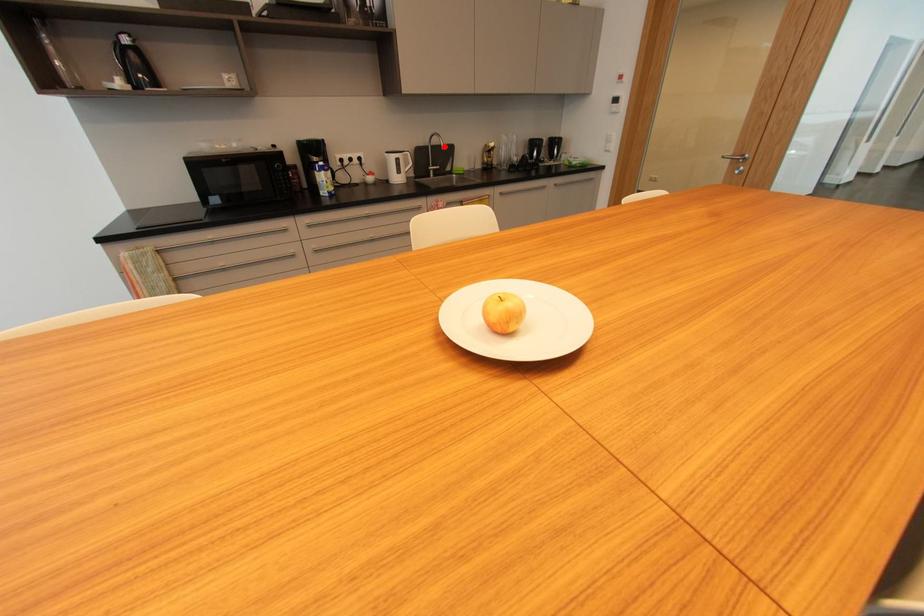
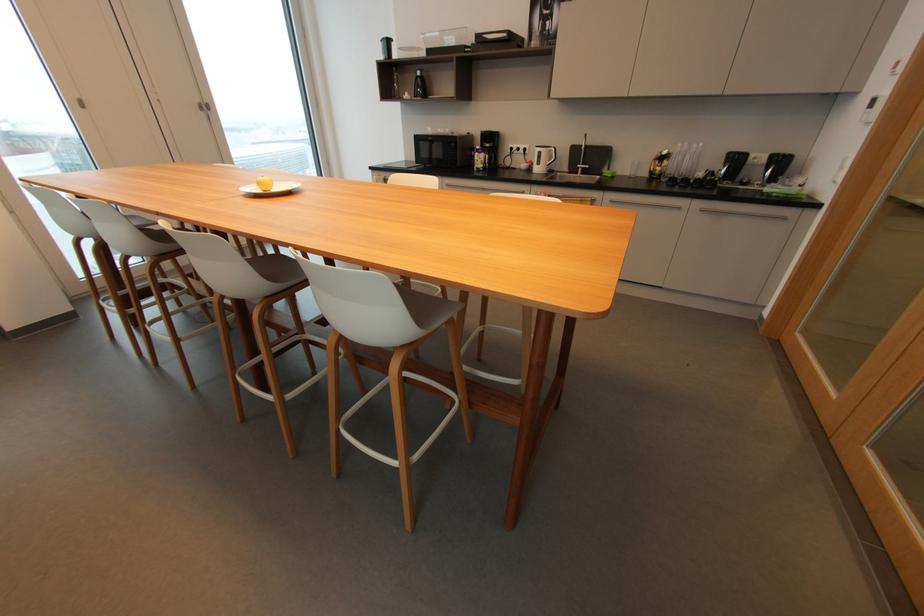
Find the pixel in the second image that matches the highlighted location in the first image.

(585, 147)